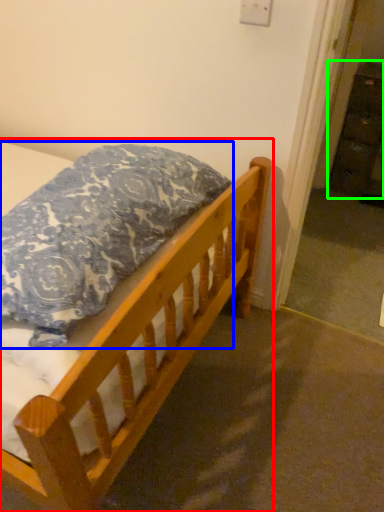
Question: Based on their relative distances, which object is nearer to bed (highlighted by a red box)? Choose from pillow (highlighted by a blue box) and dresser (highlighted by a green box).

Choices:
 (A) pillow
 (B) dresser

Answer: (A)